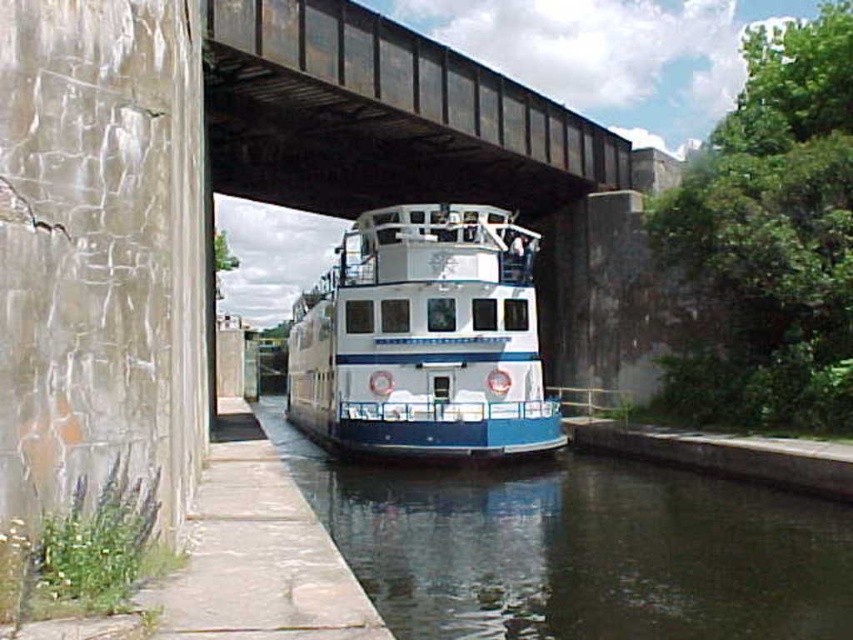
Can you confirm if smooth dark water at center is thinner than metal bridge at upper center?

Yes.

Is smooth dark water at center below metal bridge at upper center?

Yes.

Measure the distance between smooth dark water at center and camera.

smooth dark water at center is 27.12 feet from camera.

This screenshot has width=853, height=640. In order to click on smooth dark water at center in this screenshot , I will do `click(577, 547)`.

What do you see at coordinates (381, 116) in the screenshot? The width and height of the screenshot is (853, 640). I see `metal bridge at upper center` at bounding box center [381, 116].

Is point (341, 97) closer to viewer compared to point (335, 385)?

Yes, it is in front of point (335, 385).

Is point (294, 51) in front of point (381, 408)?

Yes.

The height and width of the screenshot is (640, 853). Find the location of `metal bridge at upper center`. metal bridge at upper center is located at coordinates (381, 116).

Is point (445, 476) positioned before point (438, 428)?

No, (445, 476) is behind (438, 428).

I want to click on smooth dark water at center, so click(577, 547).

Where is `smooth dark water at center`? smooth dark water at center is located at coordinates (577, 547).